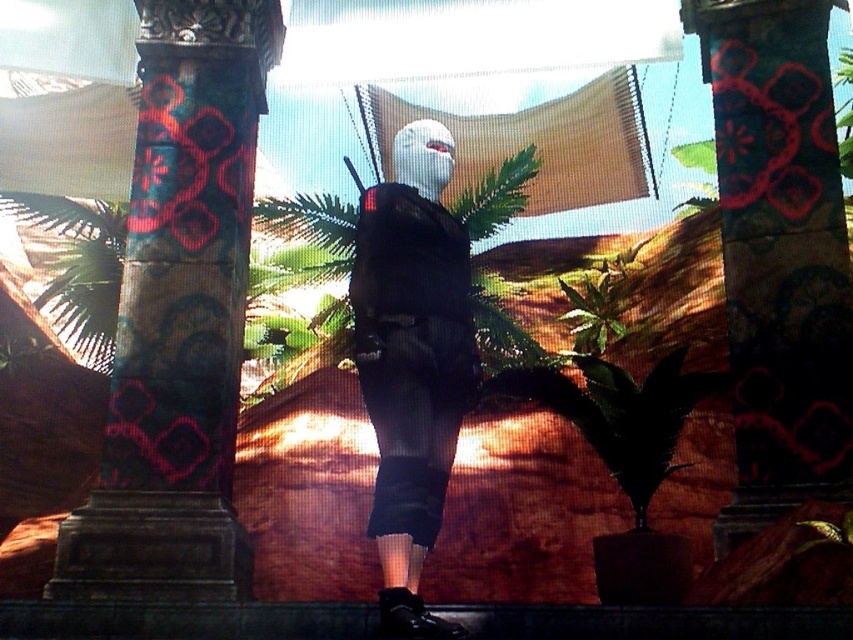
You are a game character navigating a desert level. You need to move from your current position to a checkpoint located behind the carved stone column at left. However, there is a matte black backpack at center blocking your path. Can you go around it without moving the backpack?

The carved stone column at left is further to the viewer than the matte black backpack at center, so you can go around the backpack by moving behind it towards the column.

You are a game character in the desert environment. You need to retrieve your matte black backpack at center. However, the carved stone column at center is blocking your path. Can you move around the column to reach your backpack?

The matte black backpack at center is behind the carved stone column at center, so you can move around the column to reach it since it is blocking your path.

You are a treasure hunter in the desert and see two carved stone columns. The first is the carved stone column at left and the second is the carved stone column at center. Which column is located to the left of the other?

The carved stone column at left is positioned on the left side of carved stone column at center.